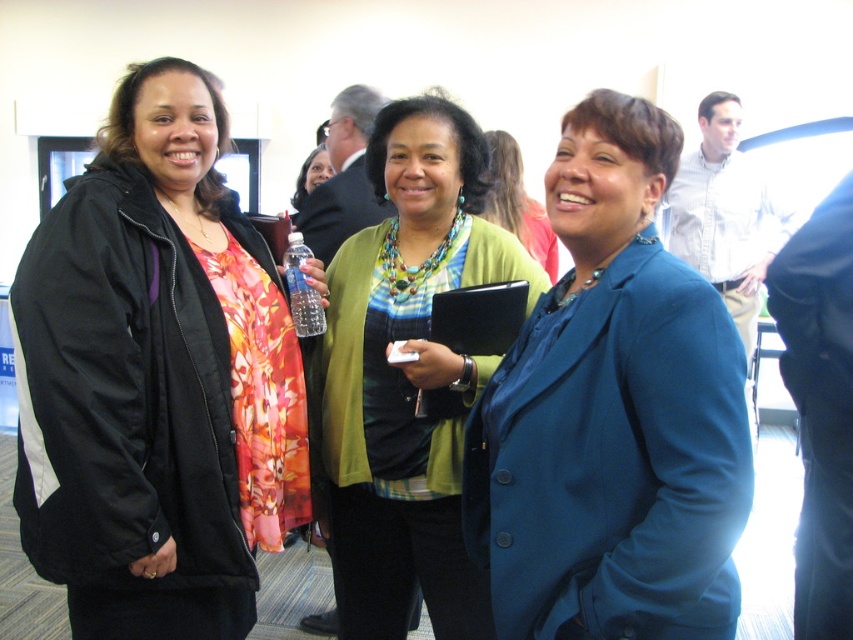
You are organizing a photo shoot and need to ensure that the green textured cardigan at center and the clear plastic bottle at center are visible in the frame. Based on their positions, which object should be placed closer to the left edge of the frame to avoid being cut off?

The clear plastic bottle at center should be placed closer to the left edge of the frame because the green textured cardigan at center is positioned on the right side of it, meaning the bottle is to the left of the cardigan.

You are organizing a small event and need to place a decorative item on a shelf that can only hold items up to the width of the green textured cardigan at center. Can the clear plastic bottle at center fit on the shelf?

The green textured cardigan at center might be wider than the clear plastic bottle at center, so there is a possibility that the clear plastic bottle at center can fit on the shelf if the cardigan is indeed wider.